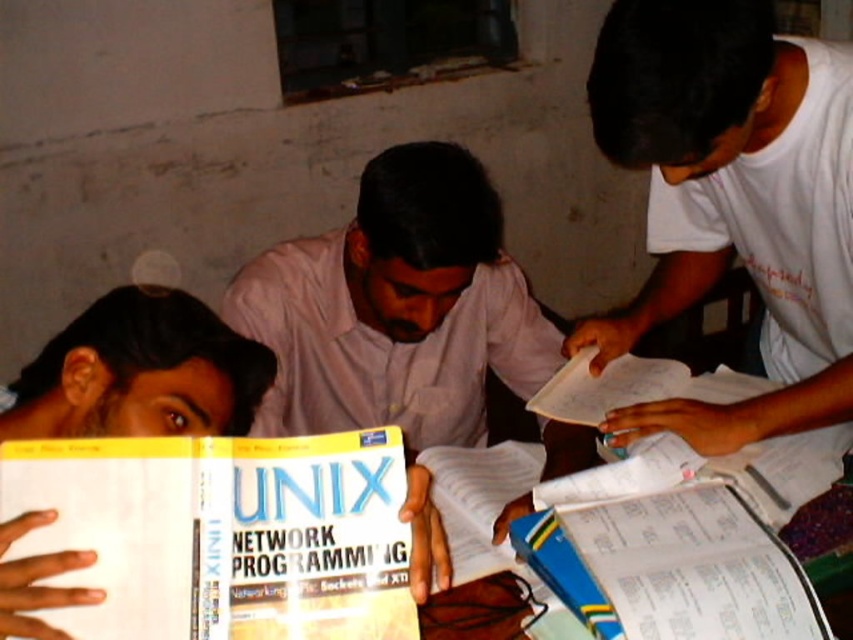
Question: Which of the following is the farthest from the observer?

Choices:
 (A) (695, 602)
 (B) (387, 557)

Answer: (A)

Question: Can you confirm if yellow paperback book at center is thinner than white paper notebook at lower right?

Choices:
 (A) yes
 (B) no

Answer: (B)

Question: Can you confirm if white matte shirt at upper right is positioned to the right of yellow paperback book at center?

Choices:
 (A) yes
 (B) no

Answer: (A)

Question: Can you confirm if white paper notebook at lower right is smaller than white paper book at center?

Choices:
 (A) yes
 (B) no

Answer: (A)

Question: Which object appears farthest from the camera in this image?

Choices:
 (A) light pink cotton shirt at center
 (B) white paper notebook at lower right
 (C) yellow paperback book at center
 (D) white matte shirt at upper right

Answer: (A)

Question: Which point appears farthest from the camera in this image?

Choices:
 (A) (467, 504)
 (B) (109, 611)
 (C) (842, 106)

Answer: (A)